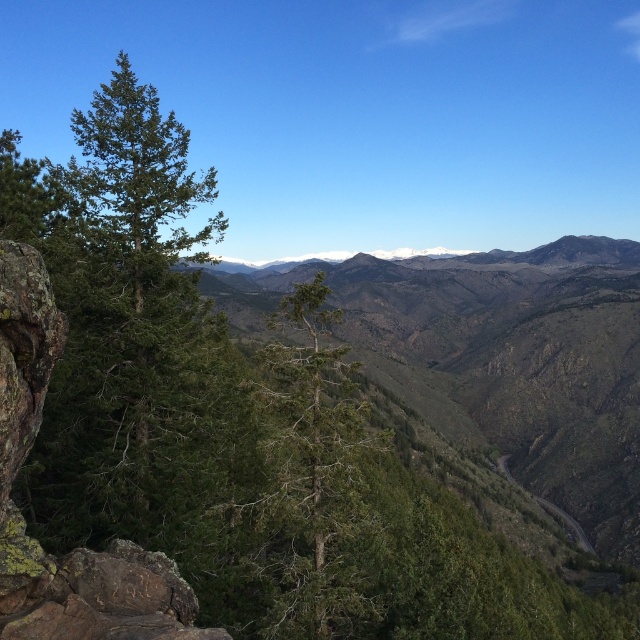
Between green matte tree at left and green textured tree at center, which one is positioned higher?

green matte tree at left is higher up.

Which is behind, point (186, 282) or point (348, 618)?

Positioned behind is point (186, 282).

Is point (108, 260) behind point (307, 504)?

Yes.

Identify the location of green matte tree at left. The width and height of the screenshot is (640, 640). [x=120, y=317].